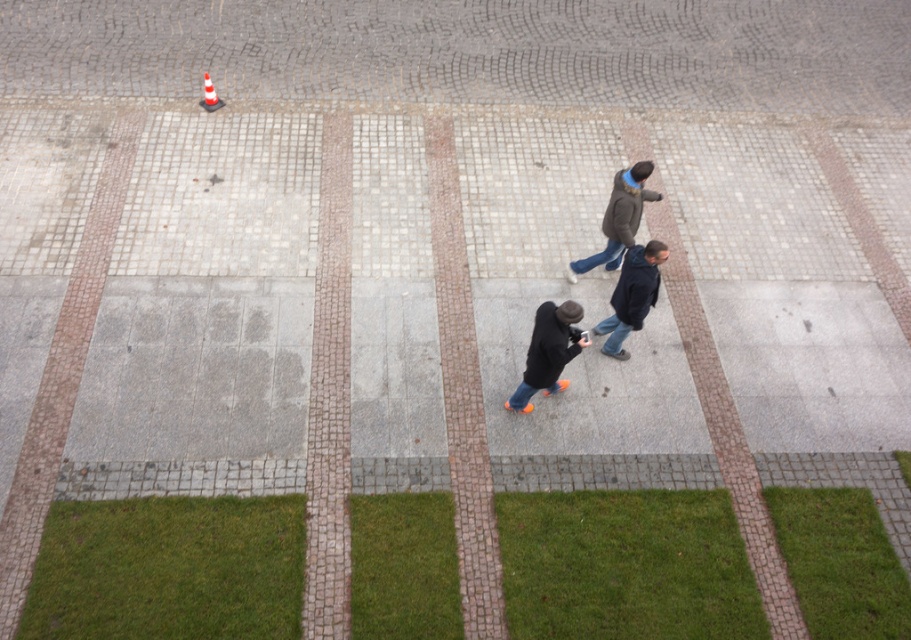
Question: Estimate the real-world distances between objects in this image. Which object is farther from the dark blue jacket at center?

Choices:
 (A) orange and white striped traffic cone at upper left
 (B) dark brown jacket at center
 (C) orange suede shoes at center

Answer: (A)

Question: Is orange suede shoes at center wider than orange and white striped traffic cone at upper left?

Choices:
 (A) no
 (B) yes

Answer: (B)

Question: Is dark blue jacket at center thinner than dark brown jacket at center?

Choices:
 (A) no
 (B) yes

Answer: (B)

Question: Does dark blue jacket at center have a lesser width compared to orange and white striped traffic cone at upper left?

Choices:
 (A) no
 (B) yes

Answer: (A)

Question: Which of the following is the farthest from the observer?

Choices:
 (A) [x=637, y=308]
 (B) [x=631, y=211]
 (C) [x=521, y=412]

Answer: (C)

Question: Which object is closer to the camera taking this photo?

Choices:
 (A) dark brown jacket at center
 (B) dark blue jacket at center
 (C) orange suede shoes at center

Answer: (C)